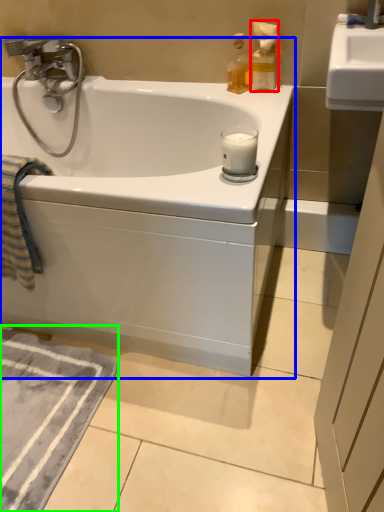
Question: Considering the real-world distances, which object is closest to bottle (highlighted by a red box)? bathtub (highlighted by a blue box) or bath mat (highlighted by a green box).

Choices:
 (A) bathtub
 (B) bath mat

Answer: (A)